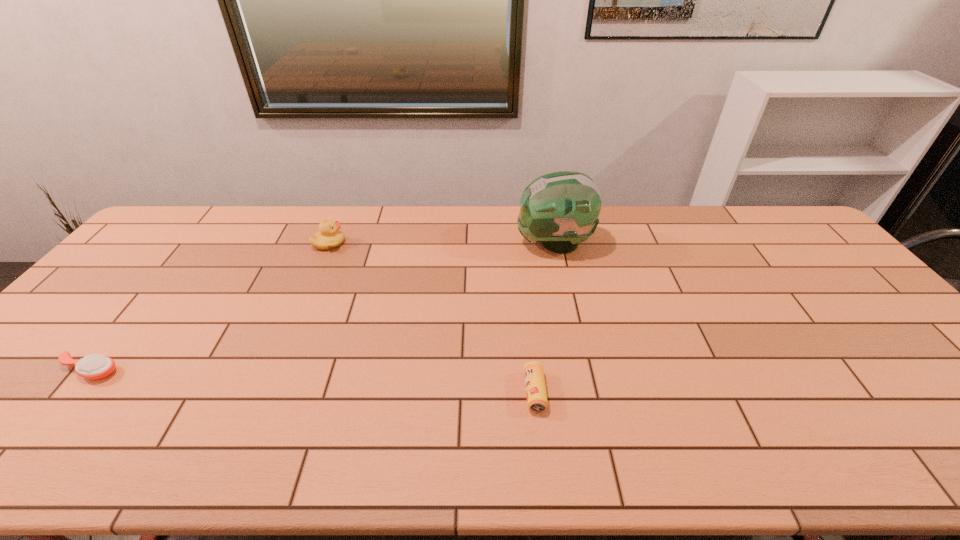
Locate an element on the screen. This screenshot has height=540, width=960. free space between the football helmet and the leftmost object is located at coordinates [x=322, y=307].

Find the location of a particular element. The width and height of the screenshot is (960, 540). vacant region between the beer can and the leftmost object is located at coordinates (312, 381).

Locate an element on the screen. vacant space that's between the second object from left to right and the beer can is located at coordinates (432, 318).

The height and width of the screenshot is (540, 960). Identify the location of free space between the beer can and the third object from right to left. (432, 318).

Image resolution: width=960 pixels, height=540 pixels. What are the coordinates of `free spot between the beer can and the leftmost object` in the screenshot? It's located at (312, 381).

I want to click on empty space that is in between the beer can and the leftmost object, so click(312, 381).

Identify the location of empty space that is in between the beer can and the football helmet. This screenshot has height=540, width=960. (544, 318).

Locate an element on the screen. This screenshot has height=540, width=960. vacant area that lies between the tallest object and the leftmost object is located at coordinates (322, 307).

I want to click on free space between the beer can and the football helmet, so click(544, 318).

Select which object appears as the second closest to the leftmost object. Please provide its 2D coordinates. Your answer should be formatted as a tuple, i.e. [(x, y)], where the tuple contains the x and y coordinates of a point satisfying the conditions above.

[(536, 395)]